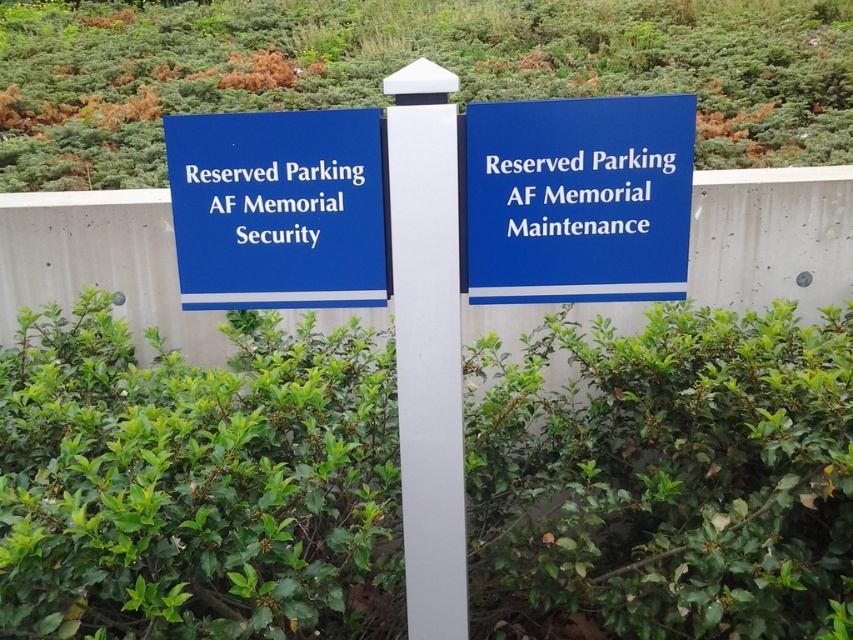
Locate an element on the screen. This screenshot has width=853, height=640. green leafy hedge at center is located at coordinates (196, 483).

Who is more forward, [700,588] or [418,561]?

Point [418,561]

Locate an element on the screen. This screenshot has width=853, height=640. green leafy hedge at center is located at coordinates (196, 483).

Can you confirm if green grass at upper center is thinner than blue plastic sign at left?

No, green grass at upper center is not thinner than blue plastic sign at left.

Is point (357, 29) positioned behind point (227, 256)?

That is True.

You are a GUI agent. You are given a task and a screenshot of the screen. Output one action in this format:
    pyautogui.click(x=<x>, y=<y>)
    Task: Click on the green grass at upper center
    This screenshot has width=853, height=640.
    Given the screenshot: What is the action you would take?
    pyautogui.click(x=403, y=65)

Is point (508, 218) farther from camera compared to point (265, 220)?

No, (508, 218) is closer to viewer.

Does blue plastic sign at center have a smaller size compared to blue plastic sign at left?

Yes, blue plastic sign at center is smaller than blue plastic sign at left.

Image resolution: width=853 pixels, height=640 pixels. Find the location of `blue plastic sign at center`. blue plastic sign at center is located at coordinates 576,198.